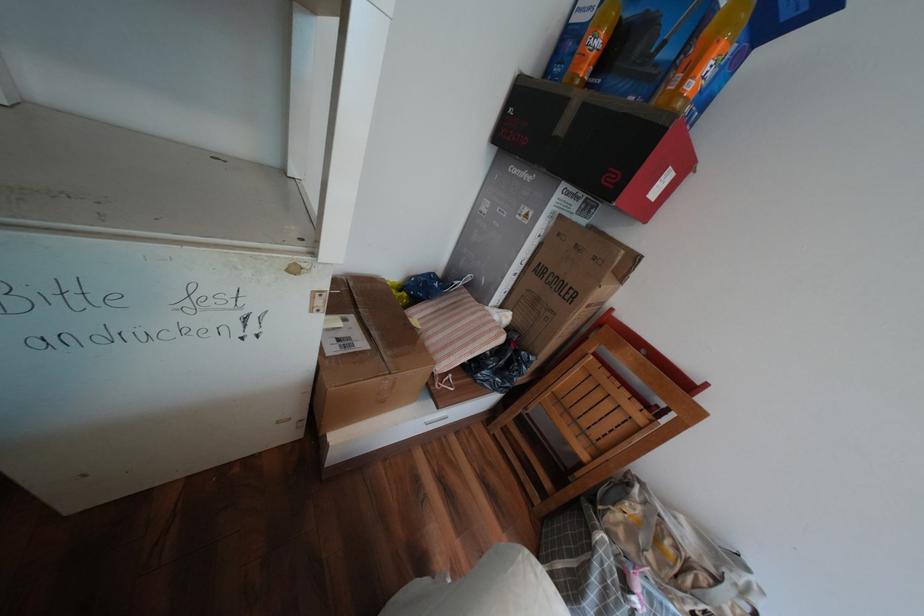
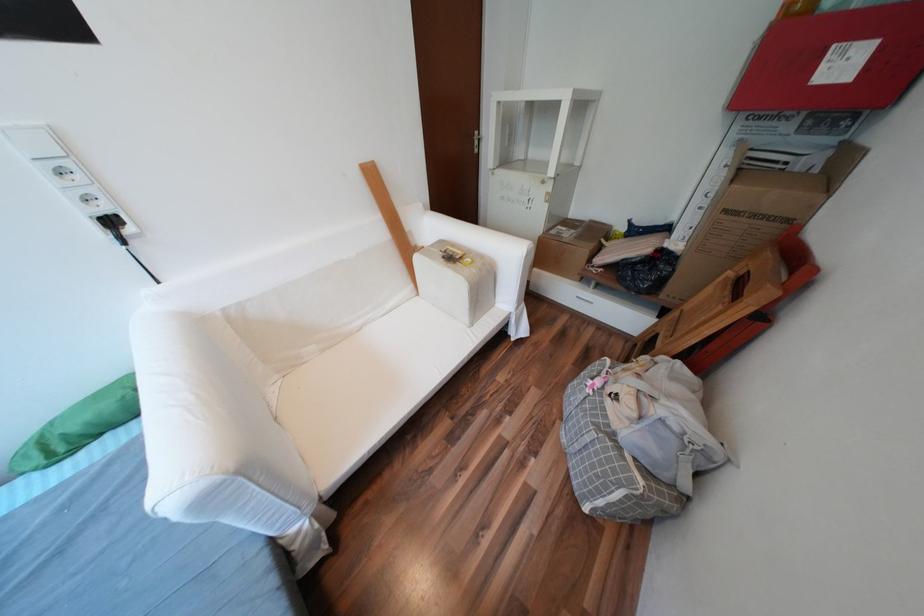
Locate, in the second image, the point that corresponds to [598,306] in the first image.

(736, 211)